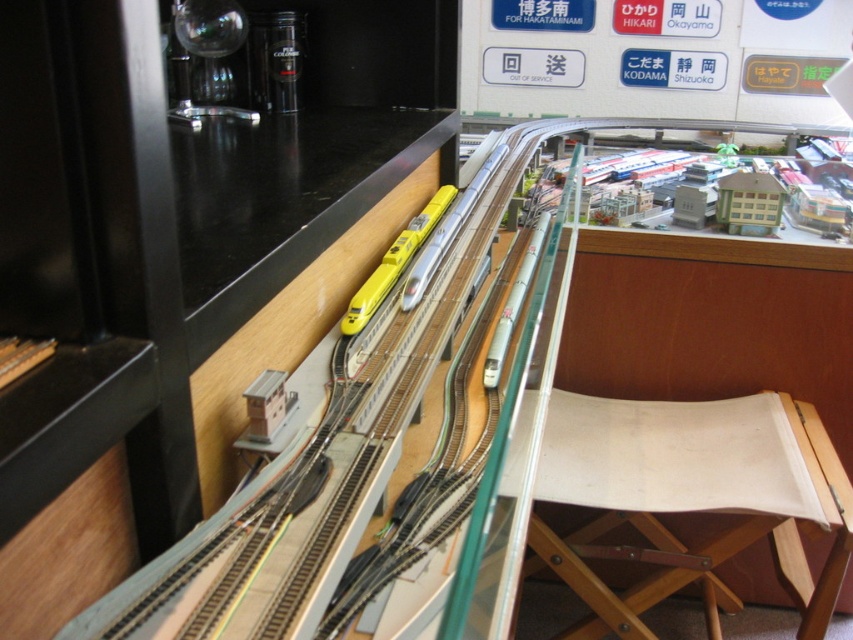
Question: Which point appears farthest from the camera in this image?

Choices:
 (A) (714, 579)
 (B) (379, 282)
 (C) (454, 234)

Answer: (A)

Question: From the image, what is the correct spatial relationship of beige canvas chair at right in relation to yellow matte train at center?

Choices:
 (A) above
 (B) below

Answer: (B)

Question: Is black glossy counter top at upper left above yellow matte train at center?

Choices:
 (A) no
 (B) yes

Answer: (B)

Question: Based on their relative distances, which object is farther from the beige canvas chair at right?

Choices:
 (A) black glossy counter top at upper left
 (B) yellow matte train at center

Answer: (A)

Question: Which of the following is the farthest from the observer?

Choices:
 (A) yellow matte train at center
 (B) beige canvas chair at right

Answer: (B)

Question: Considering the relative positions of beige canvas chair at right and silver metallic train at center in the image provided, where is beige canvas chair at right located with respect to silver metallic train at center?

Choices:
 (A) left
 (B) right

Answer: (B)